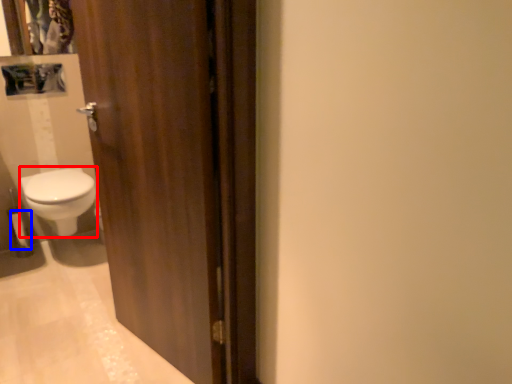
Question: Which object is further to the camera taking this photo, bidet (highlighted by a red box) or toilet paper (highlighted by a blue box)?

Choices:
 (A) bidet
 (B) toilet paper

Answer: (B)